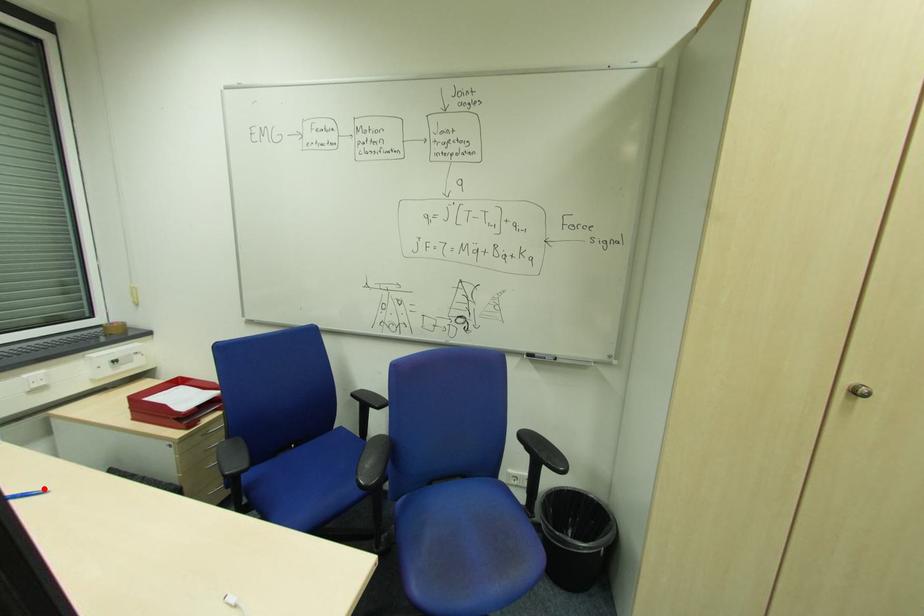
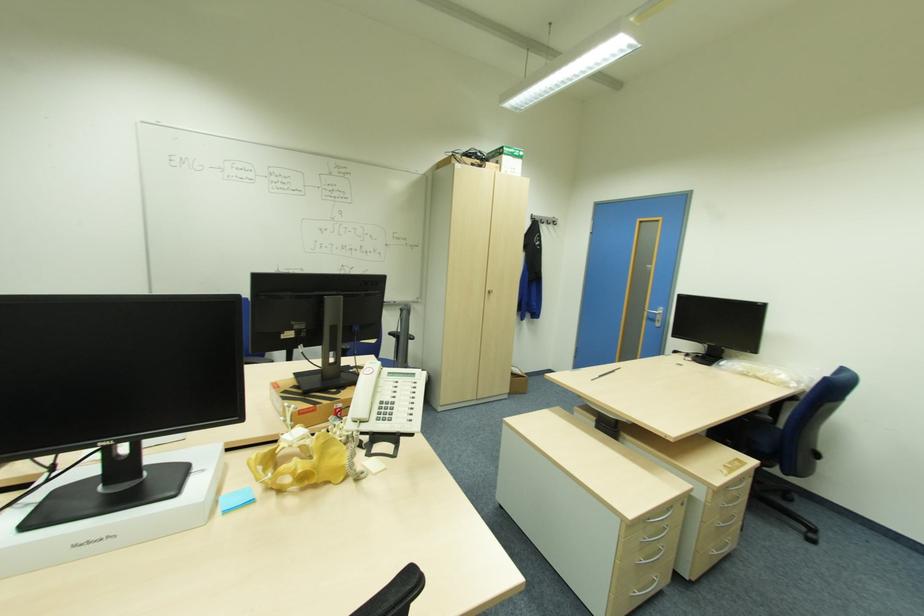
Question: I am providing you with two images of the same scene from different viewpoints. A red point is marked on the first image. At the location where the point appears in image 1, is it still visible in image 2?

Choices:
 (A) Yes
 (B) No

Answer: (B)